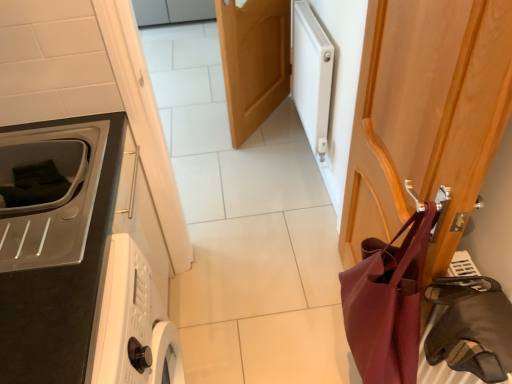
Where is `vacant area that is in front of wooden door at center, which is counted as the 1th door, starting from the back`? vacant area that is in front of wooden door at center, which is counted as the 1th door, starting from the back is located at coordinates (259, 160).